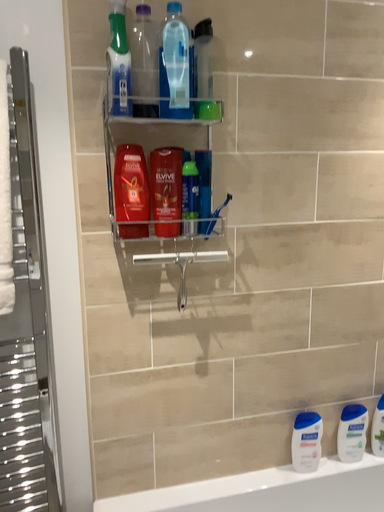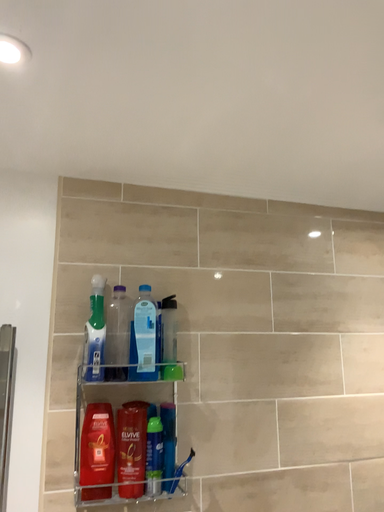
Question: How did the camera likely rotate when shooting the video?

Choices:
 (A) rotated downward
 (B) rotated upward

Answer: (B)